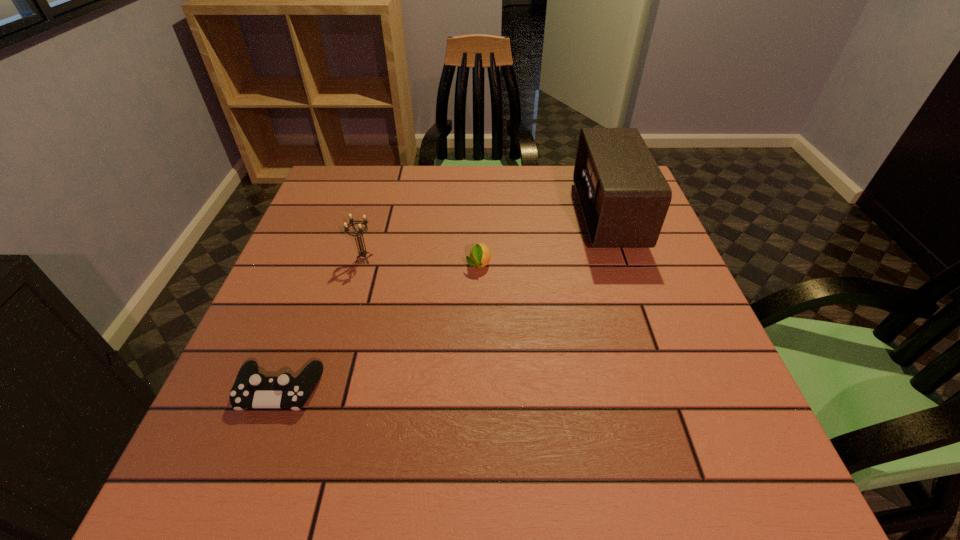
The image size is (960, 540). What are the coordinates of `blank region between the third shortest object and the control` in the screenshot? It's located at (322, 325).

This screenshot has width=960, height=540. Find the location of `vacant region between the third shortest object and the radio receiver`. vacant region between the third shortest object and the radio receiver is located at coordinates (486, 237).

Point out which object is positioned as the nearest to the third object from left to right. Please provide its 2D coordinates. Your answer should be formatted as a tuple, i.e. [(x, y)], where the tuple contains the x and y coordinates of a point satisfying the conditions above.

[(362, 253)]

Where is `object that can be found as the closest to the control`? object that can be found as the closest to the control is located at coordinates (362, 253).